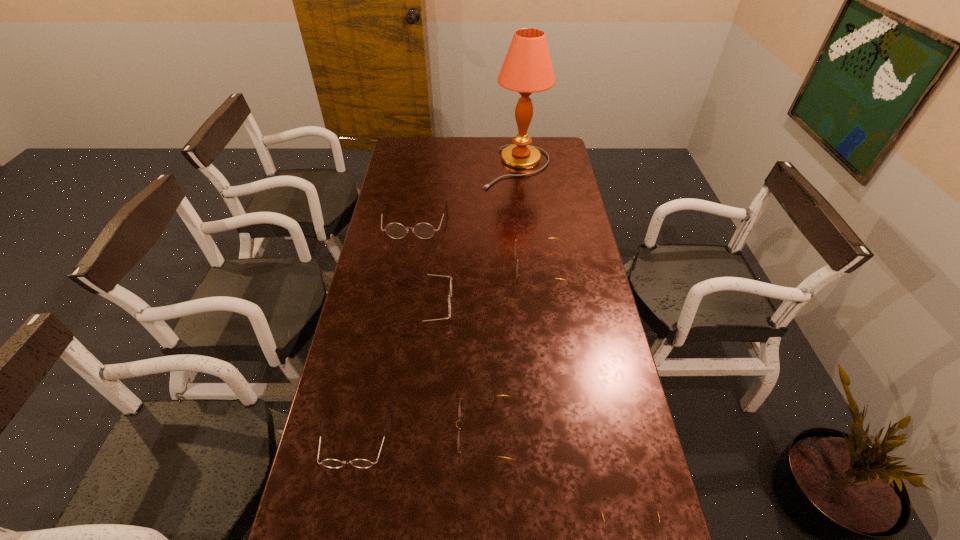
Where is `vacant point located through the lenses of the farthest spectacles`? The image size is (960, 540). vacant point located through the lenses of the farthest spectacles is located at coordinates click(401, 297).

Identify the location of vacant space located 0.350m on the temples of the biggest gold spectacles. This screenshot has width=960, height=540. (419, 266).

The height and width of the screenshot is (540, 960). In order to click on vacant space situated 0.170m on the temples of the biggest gold spectacles in this screenshot , I will do `click(468, 266)`.

Find the location of `vacant space situated on the temples of the biggest gold spectacles`. vacant space situated on the temples of the biggest gold spectacles is located at coordinates (432, 266).

The image size is (960, 540). What are the coordinates of `vacant space positioned 0.240m through the lenses of the second farthest dark spectacles` in the screenshot? It's located at (522, 304).

Identify the location of free point located 0.270m on the temples of the fourth spectacles from left to right. tap(357, 431).

Locate an element on the screen. Image resolution: width=960 pixels, height=540 pixels. vacant space located on the temples of the fourth spectacles from left to right is located at coordinates (357, 431).

Locate an element on the screen. The image size is (960, 540). blank space located on the temples of the fourth spectacles from left to right is located at coordinates (361, 431).

At what (x,y) coordinates should I click in order to perform the action: click on vacant space located 0.120m through the lenses of the nearest dark spectacles. Please return your answer as a coordinate pair (x, y). Looking at the image, I should click on (339, 522).

This screenshot has height=540, width=960. Identify the location of object located at the far edge. (527, 68).